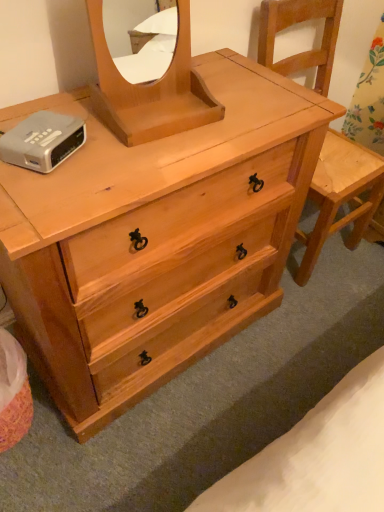
Identify the location of vacant area that lies between silver metallic alarm clock at upper left and natural wood mirror at center. The width and height of the screenshot is (384, 512). (97, 147).